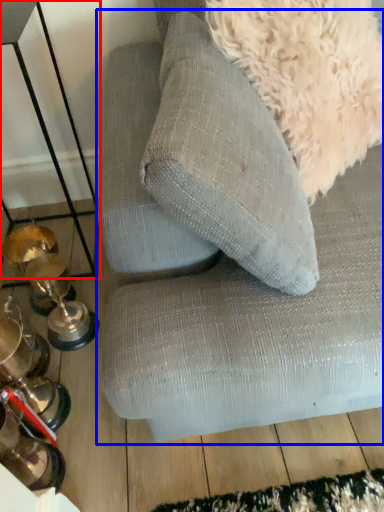
Question: Which point is further to the camera, table (highlighted by a red box) or studio couch (highlighted by a blue box)?

Choices:
 (A) table
 (B) studio couch

Answer: (A)